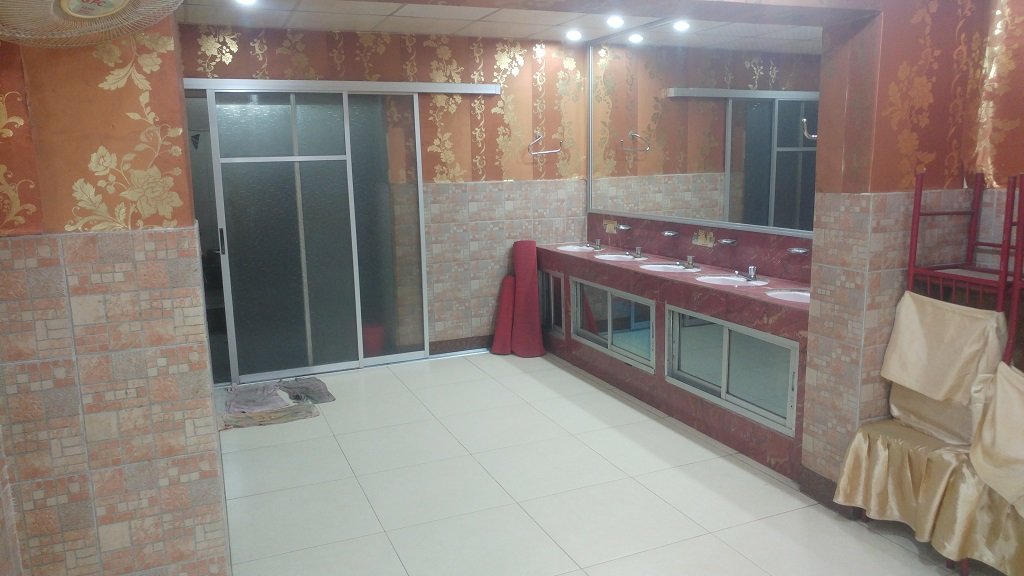
This screenshot has height=576, width=1024. I want to click on lights, so coord(612,20), coord(568,33), coord(247,2).